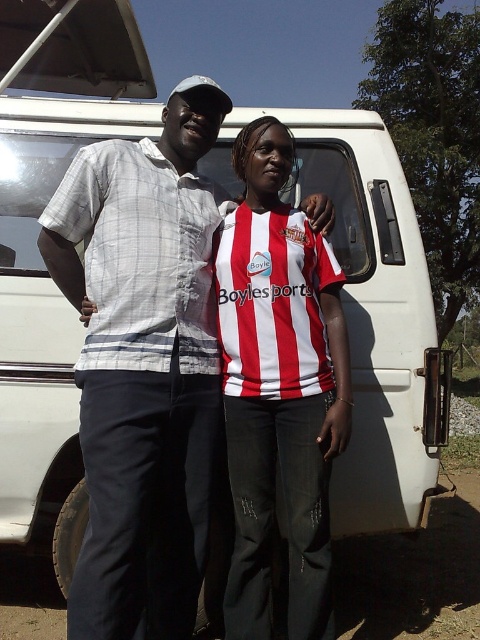
Which of these two, white checkered shirt at center or red and white striped shirt at center, stands shorter?

With less height is red and white striped shirt at center.

Who is positioned more to the right, white checkered shirt at center or red and white striped shirt at center?

red and white striped shirt at center

Is point (173, 188) in front of point (265, 400)?

That is False.

This screenshot has height=640, width=480. What are the coordinates of `white checkered shirt at center` in the screenshot? It's located at (143, 365).